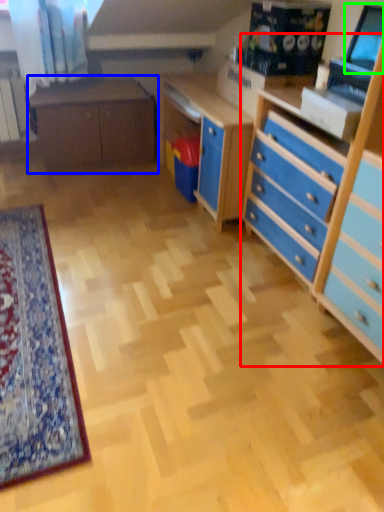
Question: Estimate the real-world distances between objects in this image. Which object is farther from chest of drawers (highlighted by a red box), table (highlighted by a blue box) or computer monitor (highlighted by a green box)?

Choices:
 (A) table
 (B) computer monitor

Answer: (A)